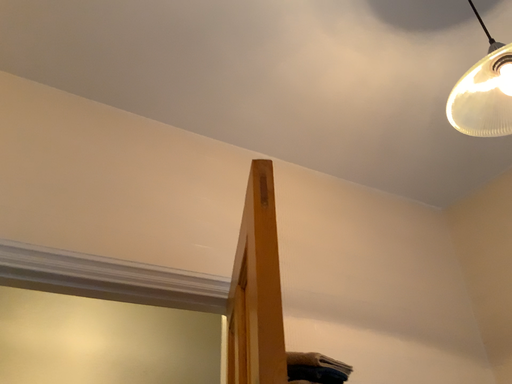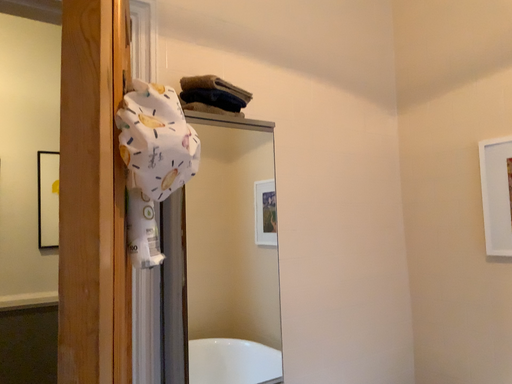
Question: Which way did the camera rotate in the video?

Choices:
 (A) rotated upward
 (B) rotated downward

Answer: (B)